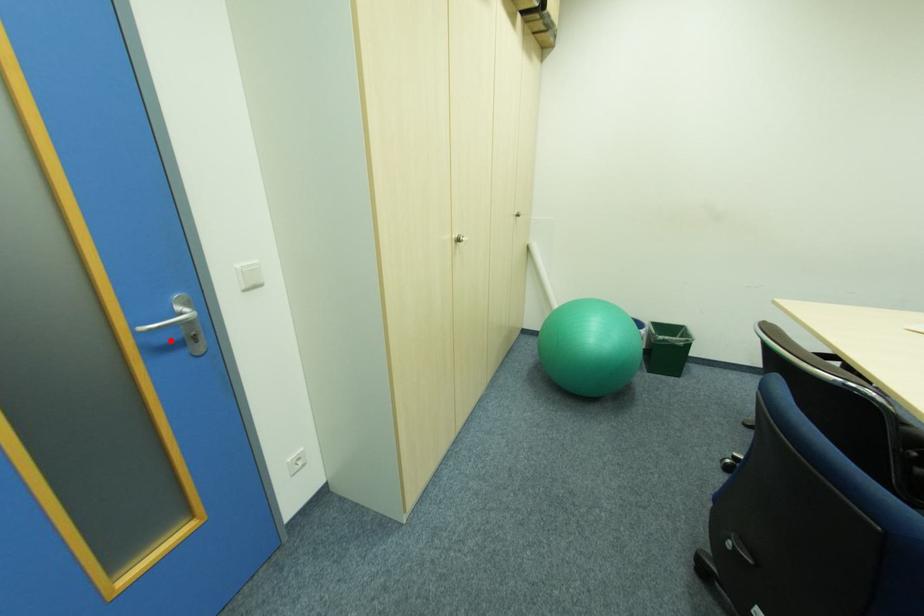
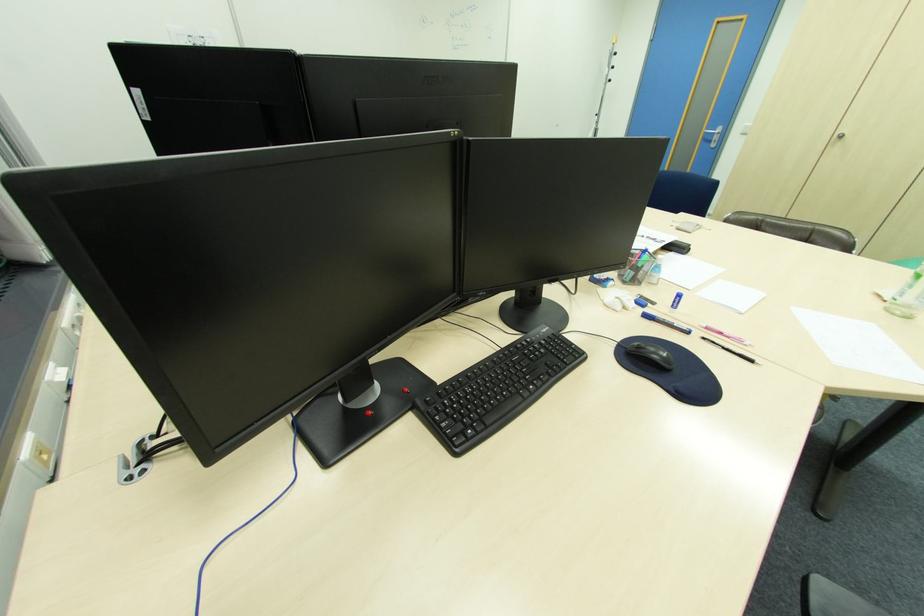
The point at the highlighted location is marked in the first image. Where is the corresponding point in the second image?

(713, 139)